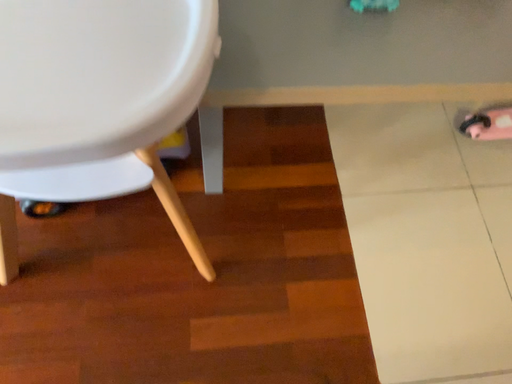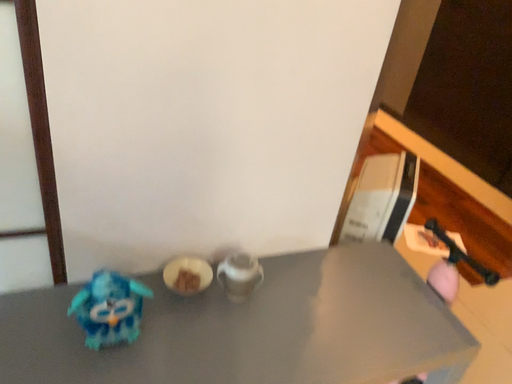
Question: Which way did the camera rotate in the video?

Choices:
 (A) rotated upward
 (B) rotated downward

Answer: (A)